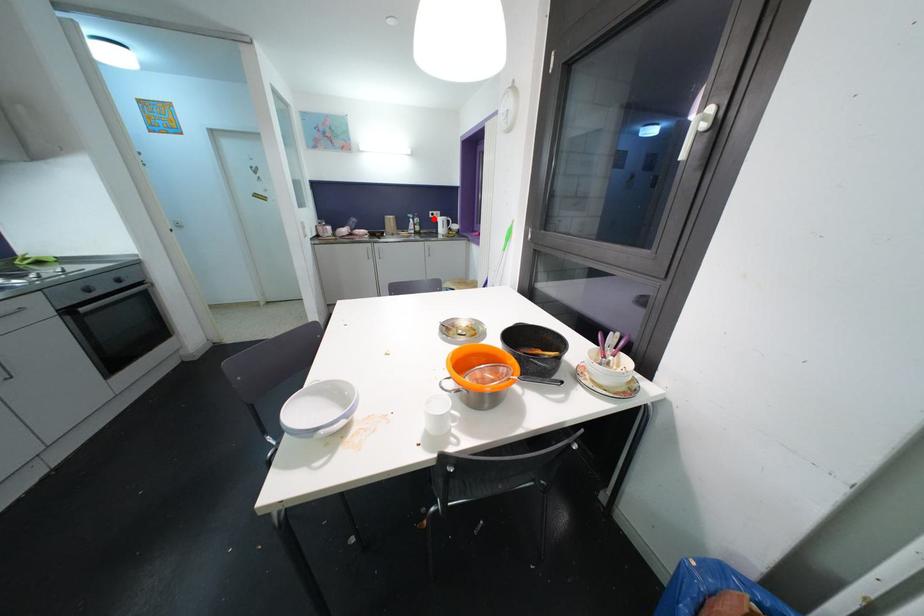
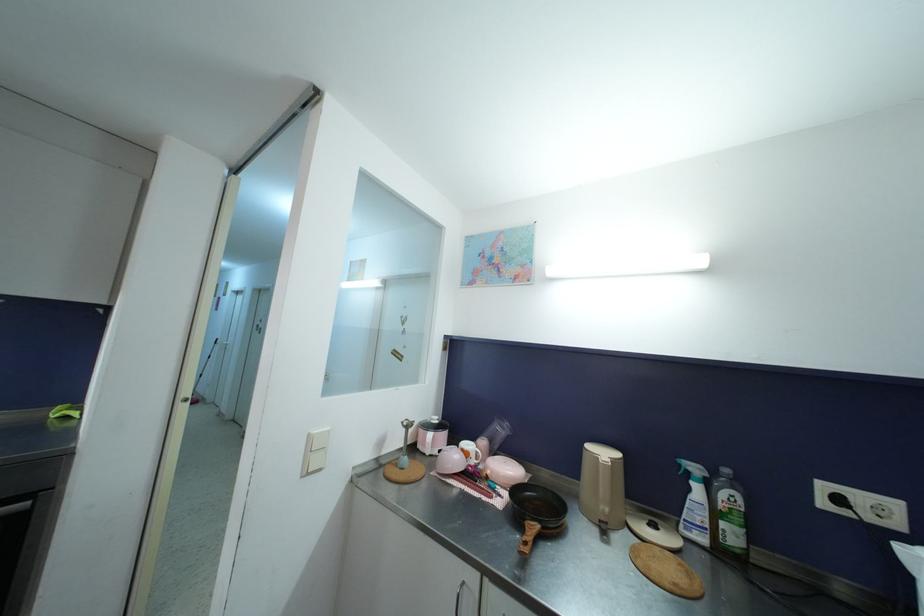
Locate, in the second image, the point that corresponds to the highlighted location in the first image.

(827, 507)